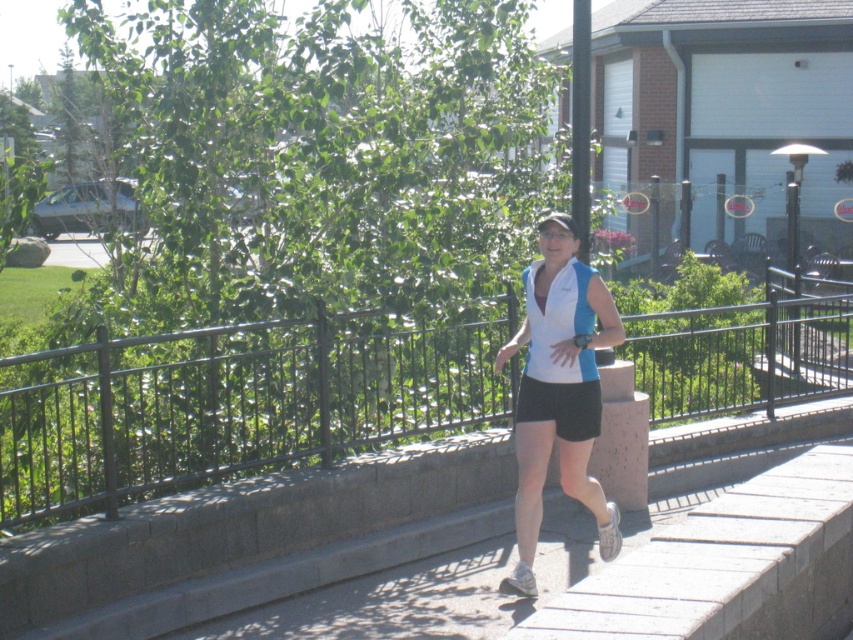
Between point (100, 435) and point (573, 358), which one is positioned behind?

Positioned behind is point (100, 435).

Can you confirm if black metal rail at center is positioned below white/blue fabric vest at center?

Indeed, black metal rail at center is positioned under white/blue fabric vest at center.

You are a GUI agent. You are given a task and a screenshot of the screen. Output one action in this format:
    pyautogui.click(x=<x>, y=<y>)
    Task: Click on the black metal rail at center
    
    Given the screenshot: What is the action you would take?
    pyautogui.click(x=231, y=404)

Can you confirm if white fabric shirt at center is shorter than white/blue fabric vest at center?

In fact, white fabric shirt at center may be taller than white/blue fabric vest at center.

Identify the location of white fabric shirt at center. The height and width of the screenshot is (640, 853). (560, 388).

Locate an element on the screen. white fabric shirt at center is located at coordinates (560, 388).

Can you confirm if black metal rail at center is wider than white fabric shirt at center?

Indeed, black metal rail at center has a greater width compared to white fabric shirt at center.

Between point (834, 390) and point (548, 380), which one is positioned in front?

Point (548, 380) is in front.

At what (x,y) coordinates should I click in order to perform the action: click on black metal rail at center. Please return your answer as a coordinate pair (x, y). This screenshot has height=640, width=853. Looking at the image, I should click on (231, 404).